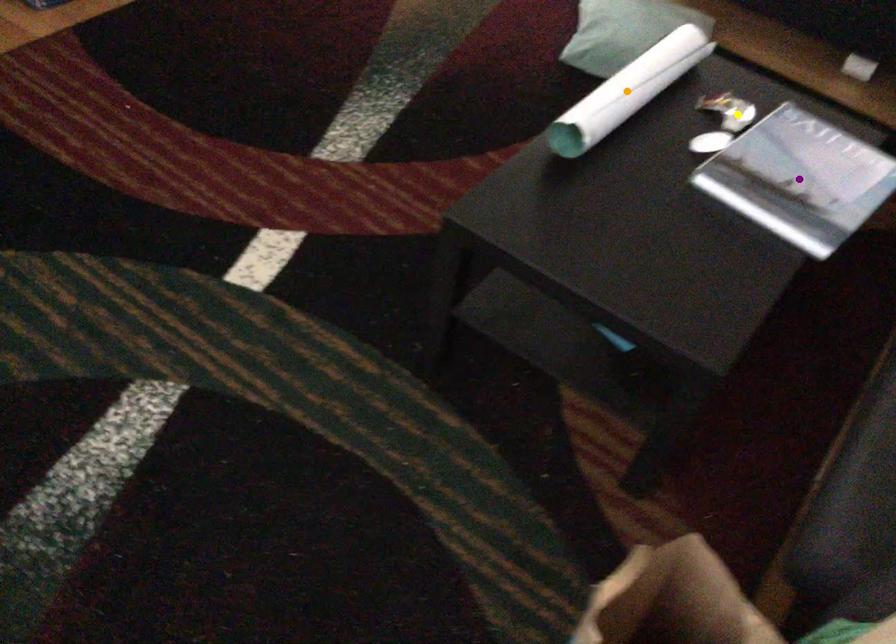
Order these from nearest to farthest:
1. purple point
2. yellow point
3. orange point

purple point → orange point → yellow point